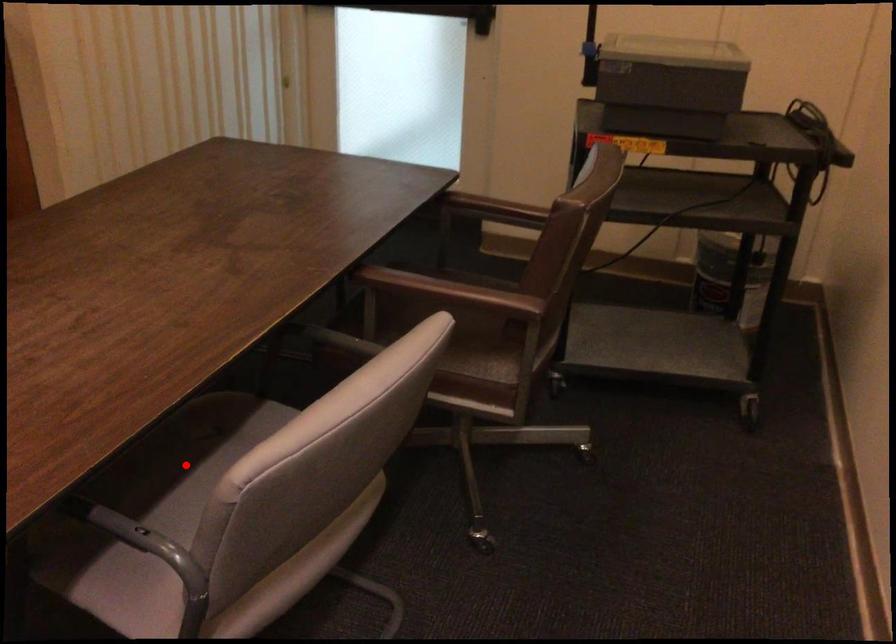
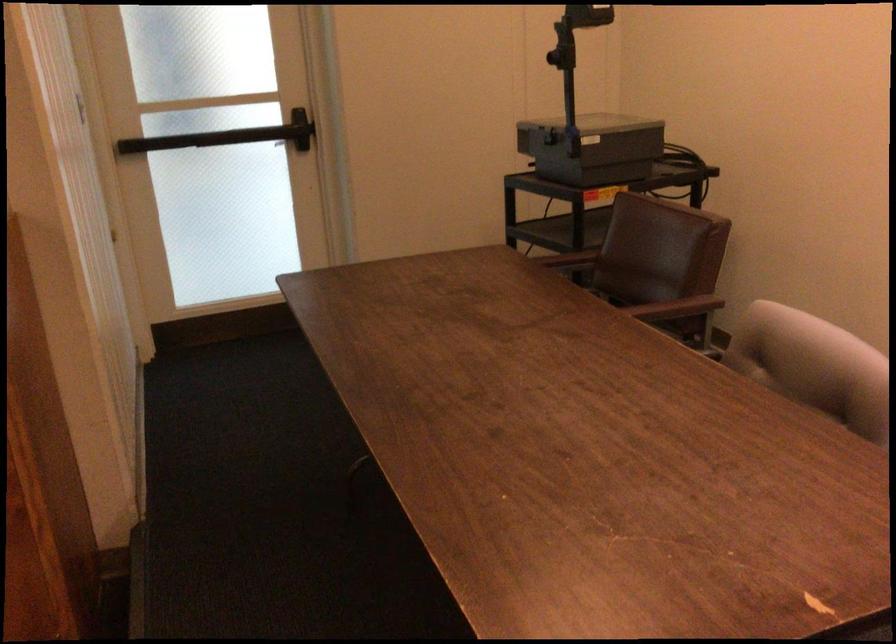
Question: I am providing you with two images of the same scene from different viewpoints. A red point is marked on the first image. Can you still see the location of the red point in image 2?

Choices:
 (A) Yes
 (B) No

Answer: (B)